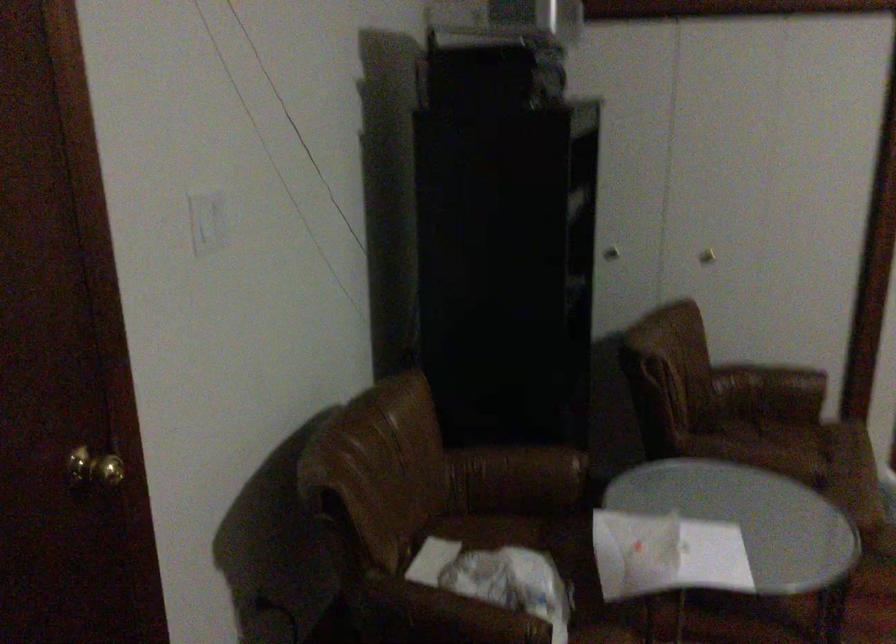
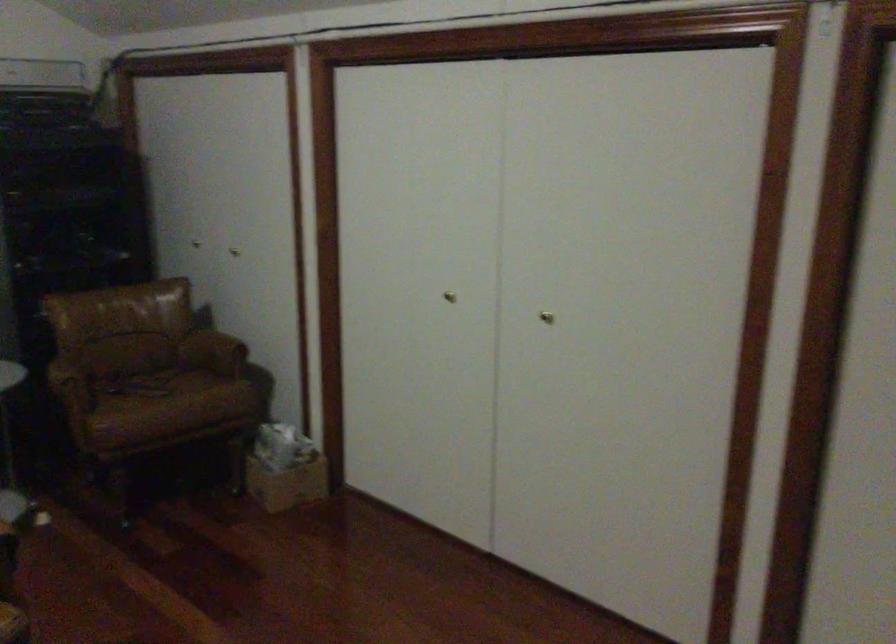
Question: Which direction would the cameraman need to move to produce the second image? Reply with the corresponding letter.

Choices:
 (A) Left
 (B) Right
 (C) Forward
 (D) Backward

Answer: (B)